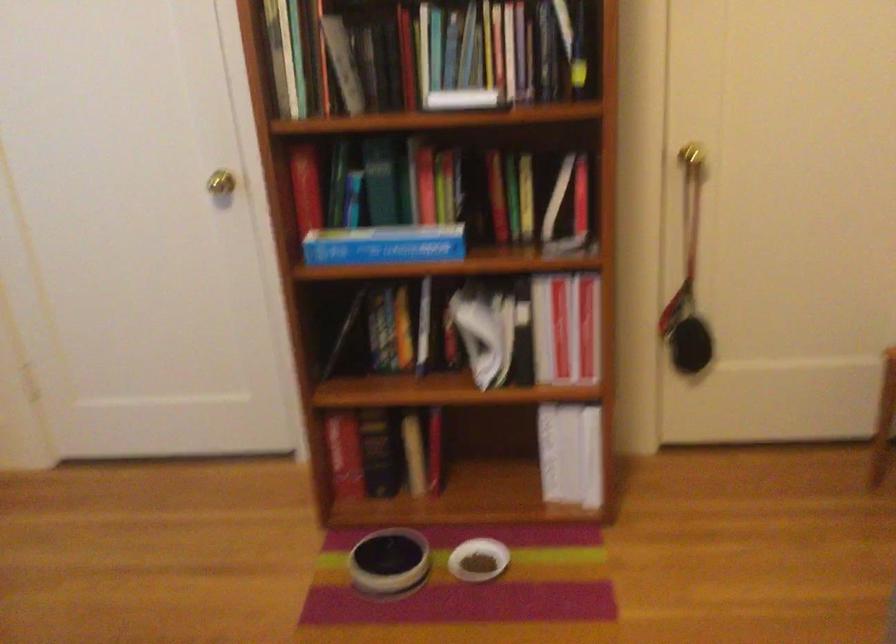
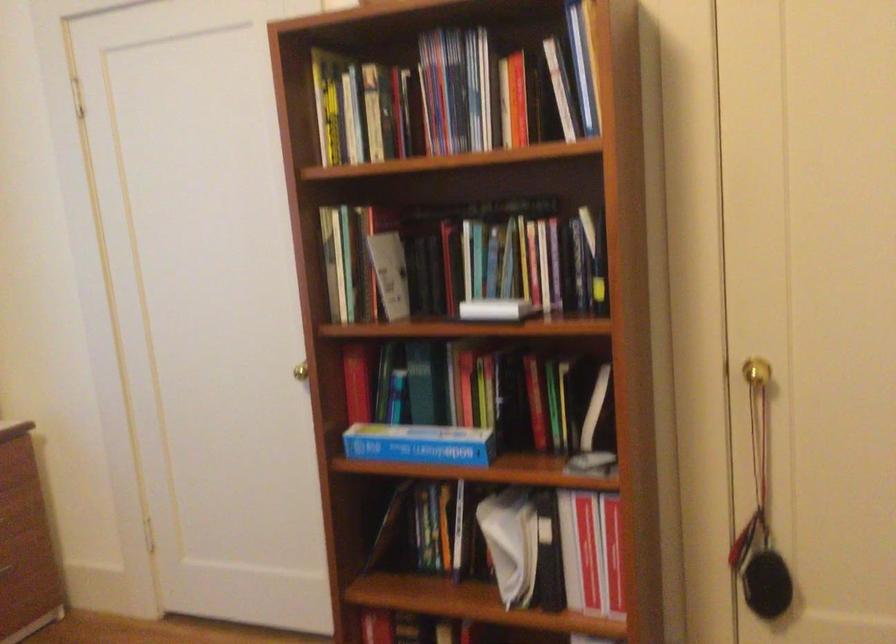
Where in the second image is the point corresponding to [392,243] from the first image?

(419, 444)